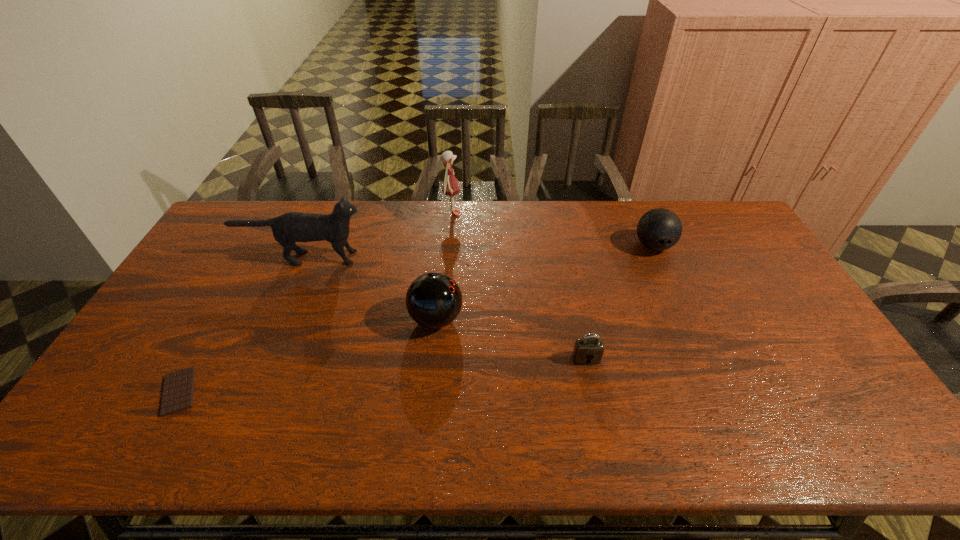
You are a GUI agent. You are given a task and a screenshot of the screen. Output one action in this format:
    pyautogui.click(x=<x>, y=<y>)
    Task: Click on the free point between the cat and the nearer bowling ball
    The image size is (960, 540).
    Given the screenshot: What is the action you would take?
    pyautogui.click(x=371, y=288)

Locate an element on the screen. This screenshot has width=960, height=540. vacant area between the left bowling ball and the nearest object is located at coordinates (307, 355).

Image resolution: width=960 pixels, height=540 pixels. In order to click on free space between the rightmost object and the fifth farthest object in this screenshot , I will do `click(620, 302)`.

This screenshot has width=960, height=540. What are the coordinates of `object that stands as the second closest to the second nearest object` in the screenshot? It's located at (659, 229).

Where is `object that can be found as the fourth closest to the cat`? The height and width of the screenshot is (540, 960). object that can be found as the fourth closest to the cat is located at coordinates (588, 350).